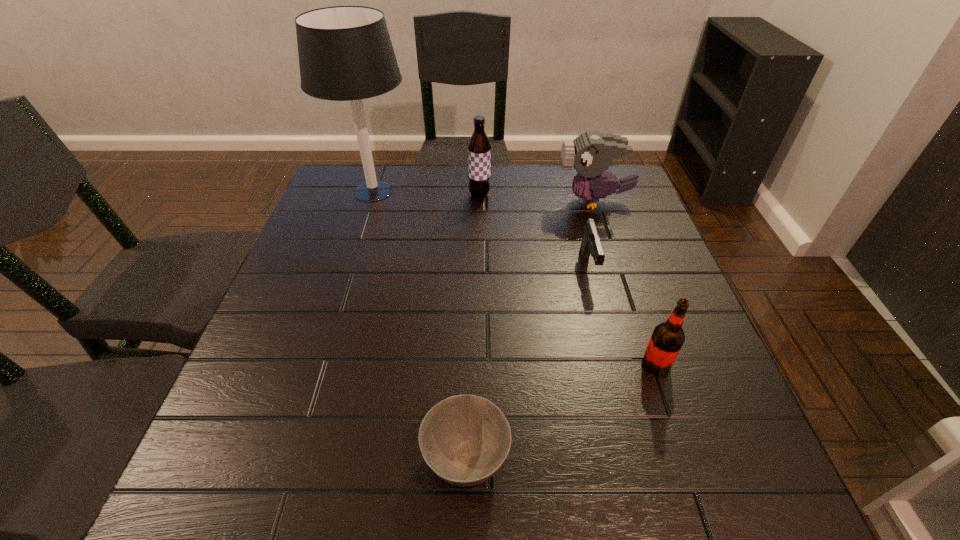
The image size is (960, 540). In the image, there is a desktop. What are the coordinates of `blank space at the left edge` in the screenshot? It's located at (342, 263).

This screenshot has width=960, height=540. What are the coordinates of `free spot at the near left corner of the desktop` in the screenshot? It's located at (x=236, y=466).

Locate an element on the screen. This screenshot has height=540, width=960. vacant space at the near right corner of the desktop is located at coordinates (702, 513).

Identify the location of free space that is in between the shorter root beer and the fourth farthest object. (622, 315).

Locate an element on the screen. The image size is (960, 540). free area in between the fifth farthest object and the leftmost object is located at coordinates (515, 278).

I want to click on empty space that is in between the shortest object and the left root beer, so click(472, 327).

Locate an element on the screen. vacant area between the nearer root beer and the fifth tallest object is located at coordinates (622, 315).

Where is `empty space that is in between the table lamp and the bowl`? The width and height of the screenshot is (960, 540). empty space that is in between the table lamp and the bowl is located at coordinates tap(420, 325).

The width and height of the screenshot is (960, 540). In order to click on vacant area that lies between the second tallest object and the bowl in this screenshot , I will do `click(472, 327)`.

At what (x,y) coordinates should I click in order to perform the action: click on free spot between the left root beer and the bird. Please return your answer as a coordinate pair (x, y). Looking at the image, I should click on (537, 198).